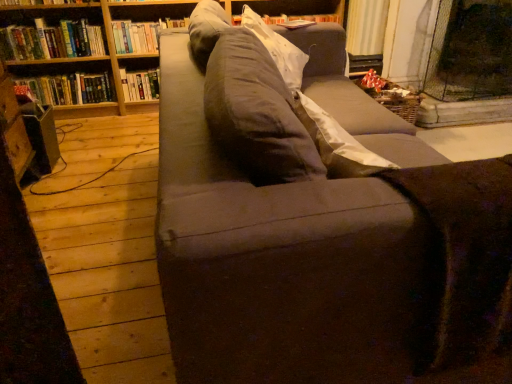
This screenshot has height=384, width=512. Describe the element at coordinates (141, 35) in the screenshot. I see `hardcover book at upper left, which is the fourth book from left to right` at that location.

Where is `wooden bookcase at upper left`? wooden bookcase at upper left is located at coordinates (87, 51).

The image size is (512, 384). What do you see at coordinates (278, 50) in the screenshot?
I see `gray fabric pillow at upper center` at bounding box center [278, 50].

Where is `hardcover book at upper left, which is the 1th book in right-to-left order`? This screenshot has height=384, width=512. hardcover book at upper left, which is the 1th book in right-to-left order is located at coordinates (141, 35).

Can you confirm if hardcover book at upper left, which is the second book in right-to-left order, is thinner than hardcover book at upper left, which appears as the 2th book when viewed from the left?

Yes.

Can you see hardcover book at upper left, the third book in the left-to-right sequence, touching hardcover book at upper left, the third book viewed from the right?

No, hardcover book at upper left, the third book in the left-to-right sequence, is not touching hardcover book at upper left, the third book viewed from the right.

Between hardcover book at upper left, which is the second book in right-to-left order, and hardcover book at upper left, which appears as the 2th book when viewed from the left, which one has larger size?

With larger size is hardcover book at upper left, which appears as the 2th book when viewed from the left.

Is dark gray fabric couch at center oriented towards wooden bookcase at upper left?

No.

Considering the sizes of objects dark gray fabric couch at center and wooden bookcase at upper left in the image provided, who is shorter, dark gray fabric couch at center or wooden bookcase at upper left?

wooden bookcase at upper left.

Is dark gray fabric couch at center next to wooden bookcase at upper left?

No, dark gray fabric couch at center is not beside wooden bookcase at upper left.

Between dark gray fabric couch at center and wooden bookcase at upper left, which one is positioned in front?

dark gray fabric couch at center is in front.

Does hardcover book at upper left, which appears as the 2th book when viewed from the left, touch dark gray fabric couch at center?

There is a gap between hardcover book at upper left, which appears as the 2th book when viewed from the left, and dark gray fabric couch at center.

Which point is more distant from viewer, [41,26] or [161,279]?

Point [41,26]

Is hardcover book at upper left, which appears as the 2th book when viewed from the left, at the right side of dark gray fabric couch at center?

No.

From the picture: Is hardcover book at upper left, which appears as the 2th book when viewed from the left, taller than dark gray fabric couch at center?

In fact, hardcover book at upper left, which appears as the 2th book when viewed from the left, may be shorter than dark gray fabric couch at center.

What's the angular difference between hardcover book at upper left, which is the fourth book from left to right, and wooden bookcase at upper left's facing directions?

0.0354 degrees separate the facing orientations of hardcover book at upper left, which is the fourth book from left to right, and wooden bookcase at upper left.

Between point (113, 22) and point (304, 0), which one is positioned in front?

Point (113, 22)

Is hardcover book at upper left, which is the fourth book from left to right, looking in the opposite direction of wooden bookcase at upper left?

Yes, hardcover book at upper left, which is the fourth book from left to right, is facing away from wooden bookcase at upper left.

Which of these two, hardcover book at upper left, which is the fourth book from left to right, or wooden bookcase at upper left, is thinner?

Thinner between the two is hardcover book at upper left, which is the fourth book from left to right.

Is gray fabric pillow at upper center not near hardcover book at upper left, which appears as the 2th book when viewed from the left?

Yes.

Consider the image. Is hardcover book at upper left, which appears as the 2th book when viewed from the left, completely or partially inside gray fabric pillow at upper center?

No, hardcover book at upper left, which appears as the 2th book when viewed from the left, is not inside gray fabric pillow at upper center.

Considering the sizes of objects gray fabric pillow at upper center and hardcover book at upper left, which appears as the 2th book when viewed from the left, in the image provided, who is taller, gray fabric pillow at upper center or hardcover book at upper left, which appears as the 2th book when viewed from the left,?

gray fabric pillow at upper center is taller.

Identify the location of pillow that appears in front of the hardcover book at upper left, the third book viewed from the right. (278, 50).

Based on the photo, which of these two, wooden bookcase at upper left or hardcover book at left, the fourth book when ordered from right to left, stands taller?

wooden bookcase at upper left is taller.

Does wooden bookcase at upper left appear on the right side of hardcover book at left, the 1th book positioned from the left?

Yes, wooden bookcase at upper left is to the right of hardcover book at left, the 1th book positioned from the left.

Between point (59, 90) and point (46, 84), which one is positioned in front?

Point (46, 84)

Is hardcover book at upper left, which appears as the 2th book when viewed from the left, bigger or smaller than hardcover book at upper left, which is the 1th book in right-to-left order?

hardcover book at upper left, which appears as the 2th book when viewed from the left, is bigger than hardcover book at upper left, which is the 1th book in right-to-left order.

How different are the orientations of hardcover book at upper left, which appears as the 2th book when viewed from the left, and hardcover book at upper left, which is the fourth book from left to right, in degrees?

hardcover book at upper left, which appears as the 2th book when viewed from the left, and hardcover book at upper left, which is the fourth book from left to right, are facing 4.09e-05 degrees away from each other.

From the image's perspective, between hardcover book at upper left, which appears as the 2th book when viewed from the left, and hardcover book at upper left, which is the fourth book from left to right, who is located below?

hardcover book at upper left, which appears as the 2th book when viewed from the left.

Is hardcover book at upper left, which appears as the 2th book when viewed from the left, looking in the opposite direction of hardcover book at upper left, which is the fourth book from left to right?

No, hardcover book at upper left, which is the fourth book from left to right, is not at the back of hardcover book at upper left, which appears as the 2th book when viewed from the left.

From the hardcover book at upper left, which appears as the 2th book when viewed from the left, count 3rd books backward and point to it. Please provide its 2D coordinates.

[(140, 85)]

In the image, there is a wooden bookcase at upper left. At what (x,y) coordinates should I click in order to perform the action: click on studio couch below it (from the image's perspective). Please return your answer as a coordinate pair (x, y). Looking at the image, I should click on (319, 228).

Estimate the real-world distances between objects in this image. Which object is further from wooden bookcase at upper left, hardcover book at upper left, which appears as the 2th book when viewed from the left, or dark gray fabric couch at center?

dark gray fabric couch at center is positioned further to the anchor wooden bookcase at upper left.

Which object lies further to the anchor point wooden bookcase at upper left, hardcover book at left, the fourth book when ordered from right to left, or hardcover book at upper left, which appears as the 2th book when viewed from the left?

hardcover book at left, the fourth book when ordered from right to left, lies further to wooden bookcase at upper left than the other object.

Which object lies further to the anchor point hardcover book at upper left, which appears as the 2th book when viewed from the left, hardcover book at left, the 1th book positioned from the left, or dark gray fabric couch at center?

dark gray fabric couch at center lies further to hardcover book at upper left, which appears as the 2th book when viewed from the left, than the other object.

Based on their spatial positions, is hardcover book at upper left, the third book viewed from the right, or hardcover book at upper left, the third book in the left-to-right sequence, further from hardcover book at left, the fourth book when ordered from right to left?

hardcover book at upper left, the third book in the left-to-right sequence, is positioned further to the anchor hardcover book at left, the fourth book when ordered from right to left.

Which object lies nearer to the anchor point hardcover book at left, the fourth book when ordered from right to left, gray fabric pillow at upper center or wooden bookcase at upper left?

wooden bookcase at upper left.

In the scene shown: From the image, which object appears to be farther from dark gray fabric couch at center, hardcover book at left, the fourth book when ordered from right to left, or hardcover book at upper left, the third book viewed from the right?

hardcover book at left, the fourth book when ordered from right to left, is further to dark gray fabric couch at center.

Based on their spatial positions, is dark gray fabric couch at center or hardcover book at upper left, the third book in the left-to-right sequence, further from gray fabric pillow at upper center?

hardcover book at upper left, the third book in the left-to-right sequence, is further to gray fabric pillow at upper center.

Considering their positions, is hardcover book at upper left, which appears as the 2th book when viewed from the left, positioned closer to hardcover book at upper left, which is the second book in right-to-left order, than dark gray fabric couch at center?

Among the two, hardcover book at upper left, which appears as the 2th book when viewed from the left, is located nearer to hardcover book at upper left, which is the second book in right-to-left order.

Where is `book between hardcover book at left, the 1th book positioned from the left, and hardcover book at upper left, the third book in the left-to-right sequence`? The height and width of the screenshot is (384, 512). book between hardcover book at left, the 1th book positioned from the left, and hardcover book at upper left, the third book in the left-to-right sequence is located at coordinates (52, 41).

You are a GUI agent. You are given a task and a screenshot of the screen. Output one action in this format:
    pyautogui.click(x=<x>, y=<y>)
    Task: Click on the bookcase between gray fabric pillow at upper center and hardcover book at upper left, which is the second book in right-to-left order, along the z-axis
    
    Given the screenshot: What is the action you would take?
    pyautogui.click(x=87, y=51)

Find the location of a particular element. This screenshot has width=512, height=384. book between dark gray fabric couch at center and hardcover book at upper left, which is the 1th book in right-to-left order, in the front-back direction is located at coordinates (52, 41).

Locate an element on the screen. The height and width of the screenshot is (384, 512). bookcase located between gray fabric pillow at upper center and hardcover book at upper left, which is the fourth book from left to right, in the depth direction is located at coordinates (87, 51).